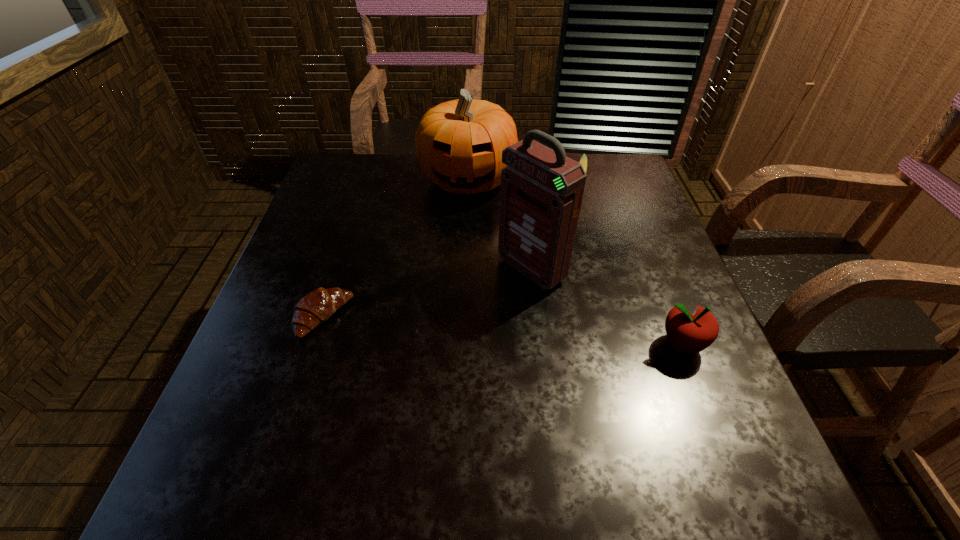
Where is `vacant region at the far right corner of the desktop`? The image size is (960, 540). vacant region at the far right corner of the desktop is located at coordinates (624, 179).

Find the location of a particular element. The width and height of the screenshot is (960, 540). free space between the fourth tallest object and the apple is located at coordinates click(631, 264).

Identify the location of vacant area that lies between the banana and the apple. The width and height of the screenshot is (960, 540). (631, 264).

Find the location of a particular element. unoccupied area between the rightmost object and the tallest object is located at coordinates (607, 307).

Locate an element on the screen. Image resolution: width=960 pixels, height=540 pixels. free point between the rightmost object and the third nearest object is located at coordinates (607, 307).

At what (x,y) coordinates should I click in order to perform the action: click on free area in between the fourth object from left to right and the rightmost object. Please return your answer as a coordinate pair (x, y). Looking at the image, I should click on (631, 264).

Locate an element on the screen. free space between the third shortest object and the leftmost object is located at coordinates (503, 332).

At what (x,y) coordinates should I click in order to perform the action: click on object that is the fourth closest to the banana. Please return your answer as a coordinate pair (x, y). The image size is (960, 540). Looking at the image, I should click on (317, 306).

Identify which object is the fourth nearest to the banana. Please provide its 2D coordinates. Your answer should be formatted as a tuple, i.e. [(x, y)], where the tuple contains the x and y coordinates of a point satisfying the conditions above.

[(317, 306)]

Locate an element on the screen. free space that satisfies the following two spatial constraints: 1. on the front side of the pumpkin; 2. on the left side of the tallest object is located at coordinates (464, 269).